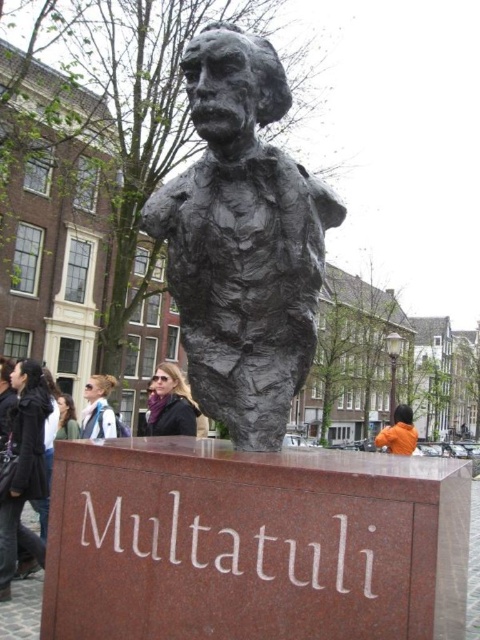
Is black bronze bust at center taller than matte black jacket at center?

Indeed, black bronze bust at center has a greater height compared to matte black jacket at center.

Between point (287, 330) and point (162, 426), which one is positioned in front?

Point (287, 330) is in front.

You are a GUI agent. You are given a task and a screenshot of the screen. Output one action in this format:
    pyautogui.click(x=<x>, y=<y>)
    Task: Click on the black bronze bust at center
    The width and height of the screenshot is (480, 640).
    Given the screenshot: What is the action you would take?
    pyautogui.click(x=242, y=241)

Who is more forward, (187, 392) or (113, 381)?

Positioned in front is point (187, 392).

In the scene shown: Can you confirm if matte black jacket at center is positioned to the left of light brown hair at center?

Incorrect, matte black jacket at center is not on the left side of light brown hair at center.

Who is more forward, (x=154, y=428) or (x=100, y=387)?

Positioned in front is point (x=154, y=428).

Locate an element on the screen. matte black jacket at center is located at coordinates (170, 403).

Who is shorter, matte black jacket at center or orange fabric jacket at lower right?

matte black jacket at center

Can you confirm if matte black jacket at center is positioned above orange fabric jacket at lower right?

Yes, matte black jacket at center is above orange fabric jacket at lower right.

Describe the element at coordinates (170, 403) in the screenshot. I see `matte black jacket at center` at that location.

Where is `matte black jacket at center`? This screenshot has width=480, height=640. matte black jacket at center is located at coordinates (170, 403).